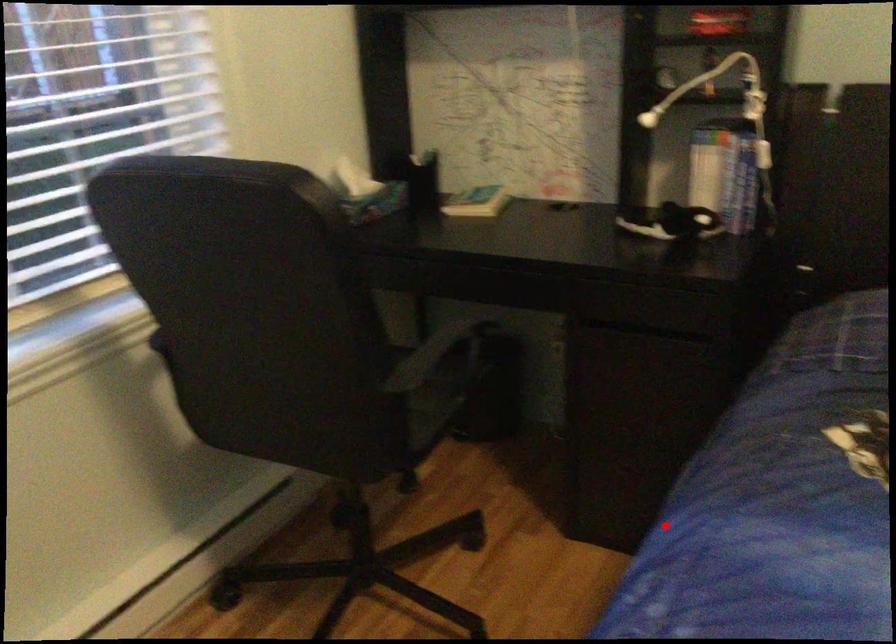
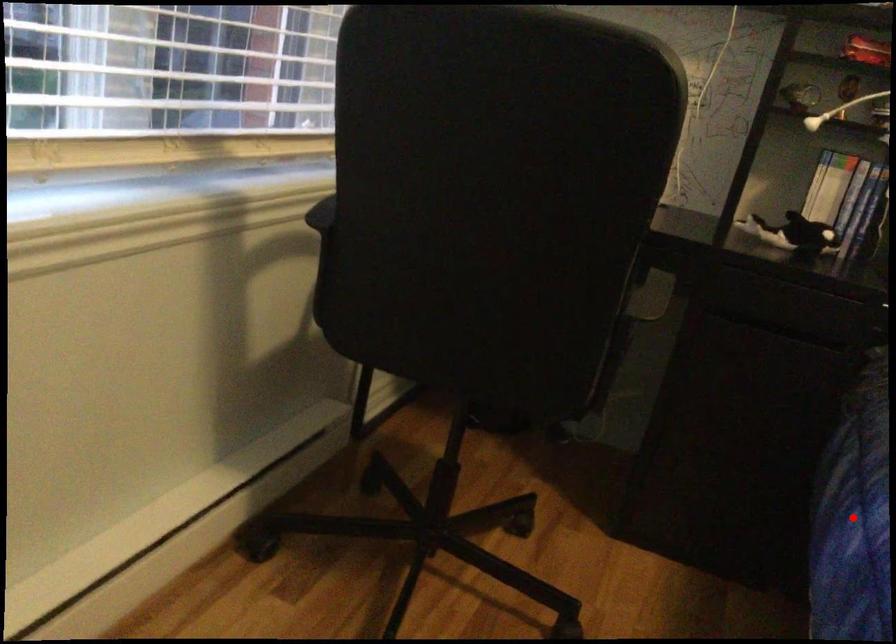
I am providing you with two images of the same scene from different viewpoints. A red point is marked on the first image and another point is marked on the second image. Is the red point in image1 aligned with the point shown in image2?

Yes